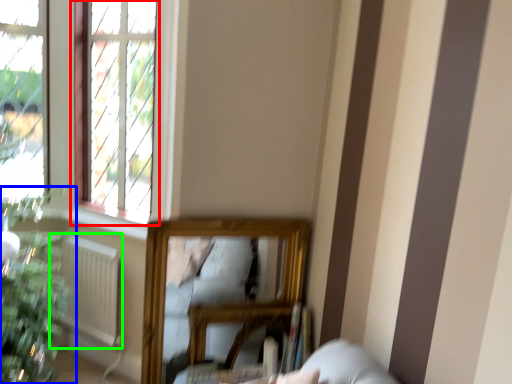
Question: Estimate the real-world distances between objects in this image. Which object is farther from window (highlighted by a red box), houseplant (highlighted by a blue box) or radiator (highlighted by a green box)?

Choices:
 (A) houseplant
 (B) radiator

Answer: (A)